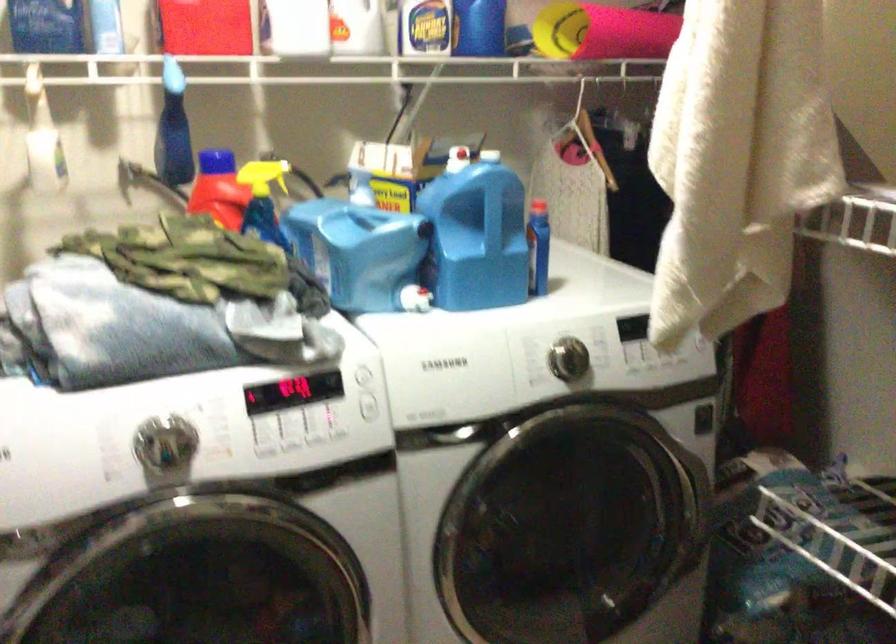
Where is `small blue bottle`? This screenshot has height=644, width=896. small blue bottle is located at coordinates tap(538, 247).